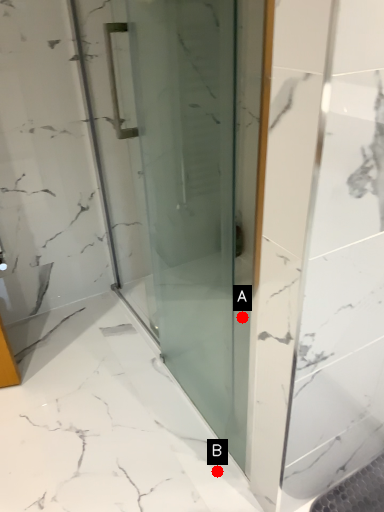
Question: Two points are circled on the image, labeled by A and B beside each circle. Which point is closer to the camera taking this photo?

Choices:
 (A) A is closer
 (B) B is closer

Answer: (B)